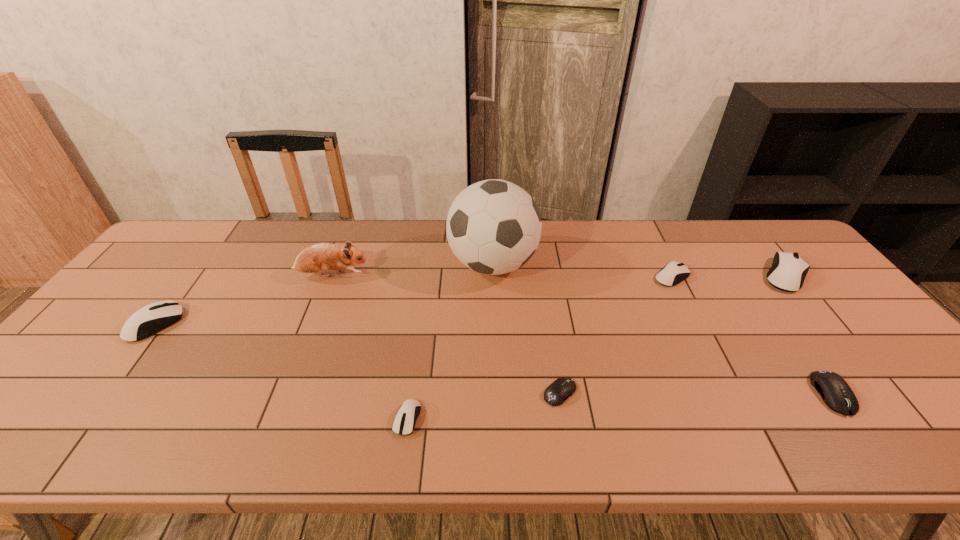
Identify the location of vacant space at the near edge of the desktop. This screenshot has height=540, width=960. (811, 426).

This screenshot has height=540, width=960. I want to click on free space at the left edge of the desktop, so (72, 370).

The width and height of the screenshot is (960, 540). I want to click on blank space at the right edge, so pos(853,355).

Where is `vacant area at the far left corner of the desktop`? This screenshot has width=960, height=540. vacant area at the far left corner of the desktop is located at coordinates (196, 231).

This screenshot has height=540, width=960. Identify the location of free location at the near left corner. (12, 426).

Image resolution: width=960 pixels, height=540 pixels. I want to click on vacant space at the far right corner of the desktop, so click(769, 228).

Where is `empty space that is in between the right black computer equipment and the tallest computer equipment`? This screenshot has width=960, height=540. empty space that is in between the right black computer equipment and the tallest computer equipment is located at coordinates (809, 335).

You are a GUI agent. You are given a task and a screenshot of the screen. Output one action in this format:
    pyautogui.click(x=<x>, y=<y>)
    Task: Click on the free area in between the tallest computer equipment and the fifth computer equipment from right to left
    The height and width of the screenshot is (540, 960).
    Given the screenshot: What is the action you would take?
    pyautogui.click(x=596, y=347)

This screenshot has width=960, height=540. I want to click on vacant space in between the tallest object and the second object from right to left, so click(662, 329).

The height and width of the screenshot is (540, 960). In order to click on vacant region between the third computer equipment from left to right and the brown hamster in this screenshot , I will do `click(446, 334)`.